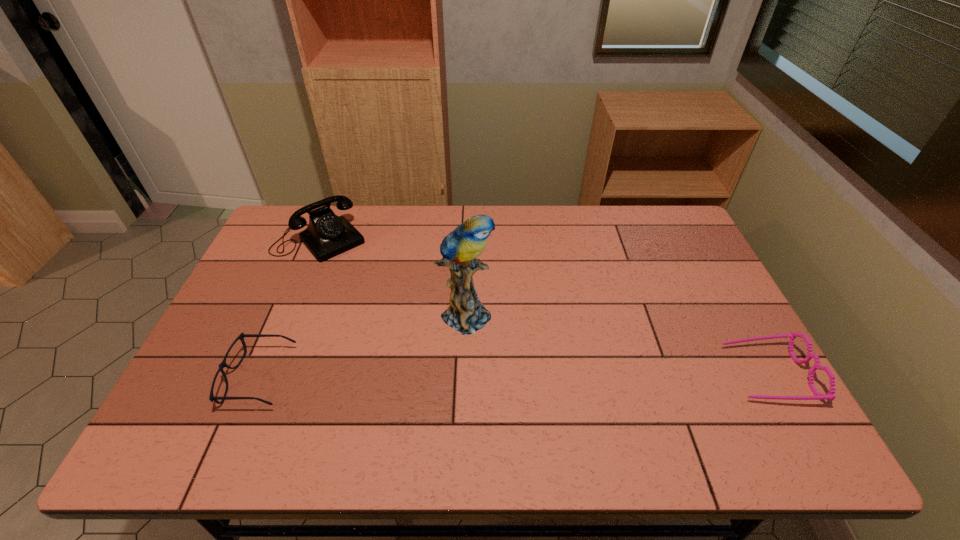
In order to click on the left spectacles in this screenshot , I will do `click(223, 364)`.

Image resolution: width=960 pixels, height=540 pixels. I want to click on the shortest object, so click(223, 364).

The width and height of the screenshot is (960, 540). I want to click on the rightmost object, so click(830, 395).

Locate an element on the screen. Image resolution: width=960 pixels, height=540 pixels. the right spectacles is located at coordinates (830, 395).

Locate an element on the screen. The image size is (960, 540). the farthest object is located at coordinates pyautogui.click(x=327, y=235).

This screenshot has height=540, width=960. Identify the location of the second tallest object. (327, 235).

This screenshot has height=540, width=960. I want to click on the second farthest object, so click(466, 314).

Locate an element on the screen. The image size is (960, 540). parrot is located at coordinates (466, 314).

This screenshot has height=540, width=960. Identify the location of vacant space located 0.060m on the front-facing side of the shorter spectacles. (203, 377).

Find the location of `blank space located on the arms of the second shortest object`. blank space located on the arms of the second shortest object is located at coordinates (703, 374).